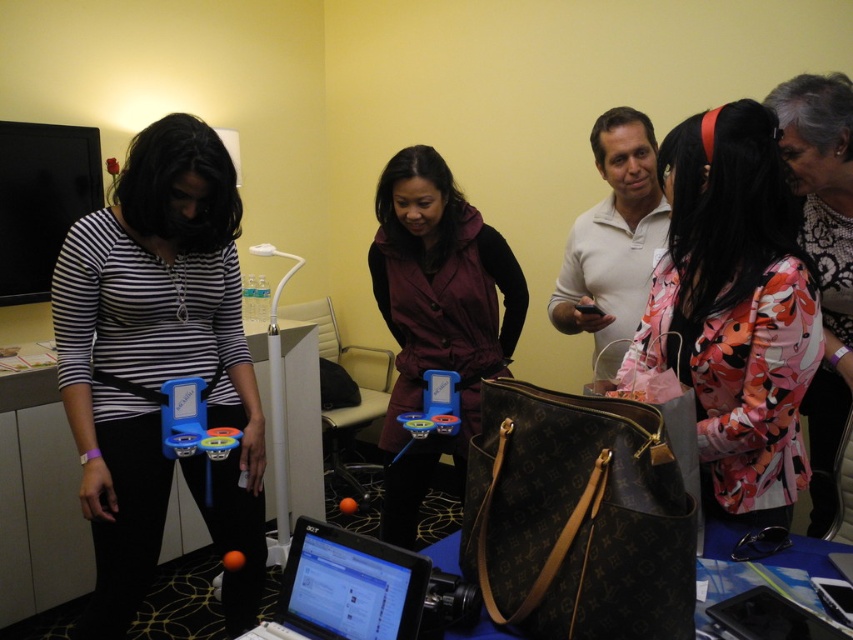
Question: Which object is the farthest from the black plastic laptop at lower right?

Choices:
 (A) floral fabric jacket at center
 (B) black glossy laptop at center

Answer: (B)

Question: Is floral fabric blouse at center positioned in front of black glossy laptop at center?

Choices:
 (A) yes
 (B) no

Answer: (B)

Question: Considering the relative positions of burgundy fabric vest at center and black glossy laptop at center in the image provided, where is burgundy fabric vest at center located with respect to black glossy laptop at center?

Choices:
 (A) right
 (B) left

Answer: (A)

Question: Among these objects, which one is farthest from the camera?

Choices:
 (A) floral fabric blouse at center
 (B) black glossy laptop at center
 (C) brown leather bag at lower center
 (D) matte black shirt at center

Answer: (D)

Question: Which object appears farthest from the camera in this image?

Choices:
 (A) floral fabric blouse at center
 (B) burgundy fabric vest at center
 (C) black plastic laptop at lower right
 (D) floral fabric jacket at center

Answer: (B)

Question: Is floral fabric jacket at center positioned at the back of black glossy laptop at center?

Choices:
 (A) yes
 (B) no

Answer: (A)